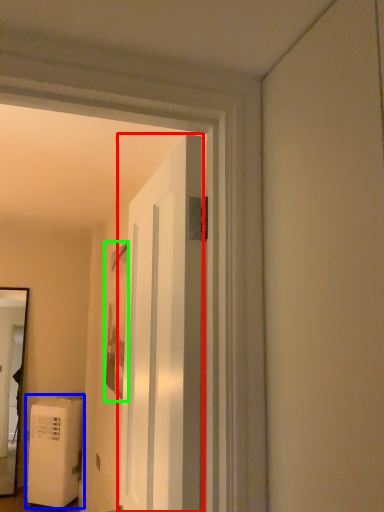
Question: Based on their relative distances, which object is farther from door (highlighted by a red box)? Choose from water heater (highlighted by a blue box) and picture frame (highlighted by a green box).

Choices:
 (A) water heater
 (B) picture frame

Answer: (A)